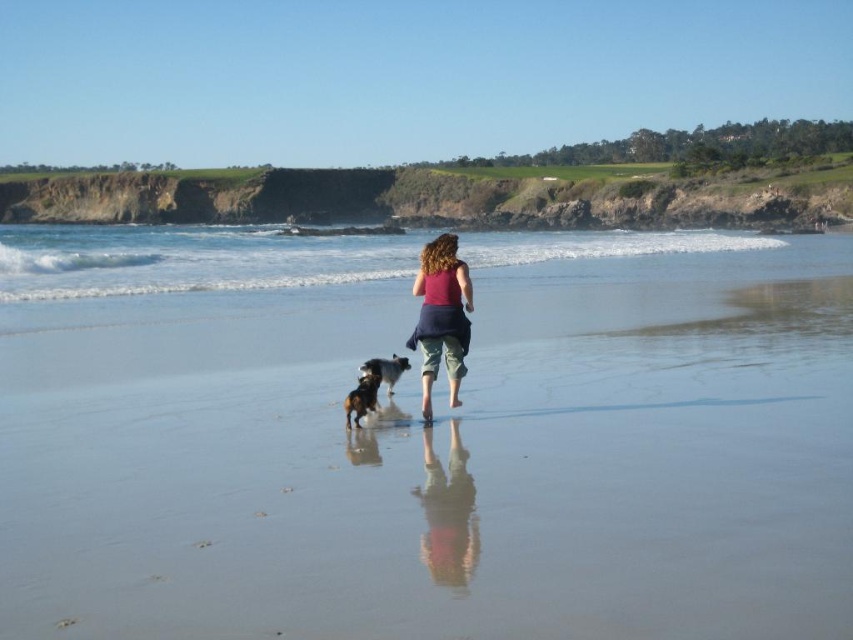
Does matte pink tank top at center have a lesser height compared to brown fur dog at center?

Yes.

Is matte pink tank top at center to the right of brown fur dog at center from the viewer's perspective?

Indeed, matte pink tank top at center is positioned on the right side of brown fur dog at center.

The image size is (853, 640). I want to click on matte pink tank top at center, so click(x=440, y=316).

Is sandy beach at center shorter than matte pink tank top at center?

No, sandy beach at center is not shorter than matte pink tank top at center.

Is point (755, 312) more distant than point (444, 256)?

Yes, it is behind point (444, 256).

Identify the location of sandy beach at center. pos(424,438).

Does matte pink tank top at center have a larger size compared to shiny black fur at center?

Incorrect, matte pink tank top at center is not larger than shiny black fur at center.

Does point (468, 308) come closer to viewer compared to point (392, 365)?

Yes, it is in front of point (392, 365).

Find the location of a particular element. matte pink tank top at center is located at coordinates (440, 316).